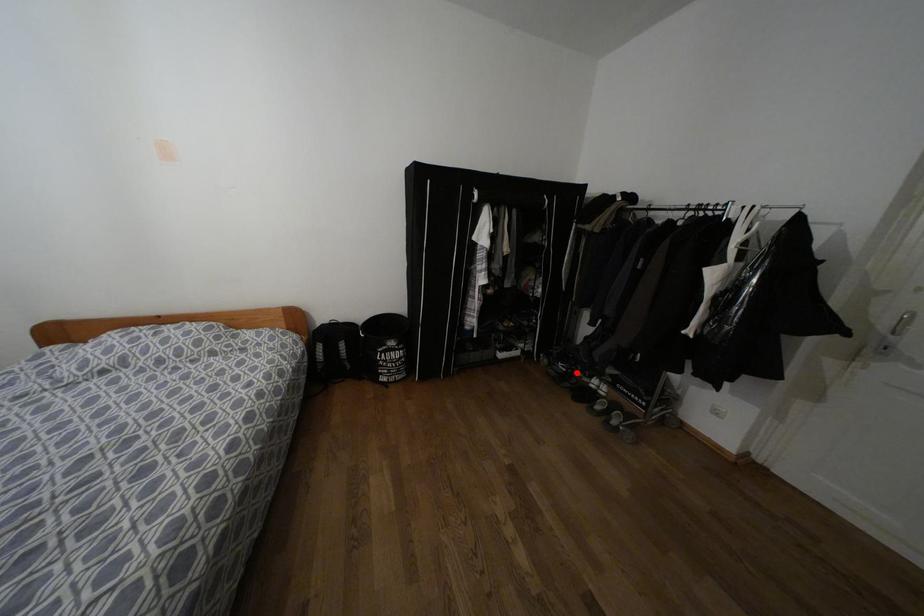
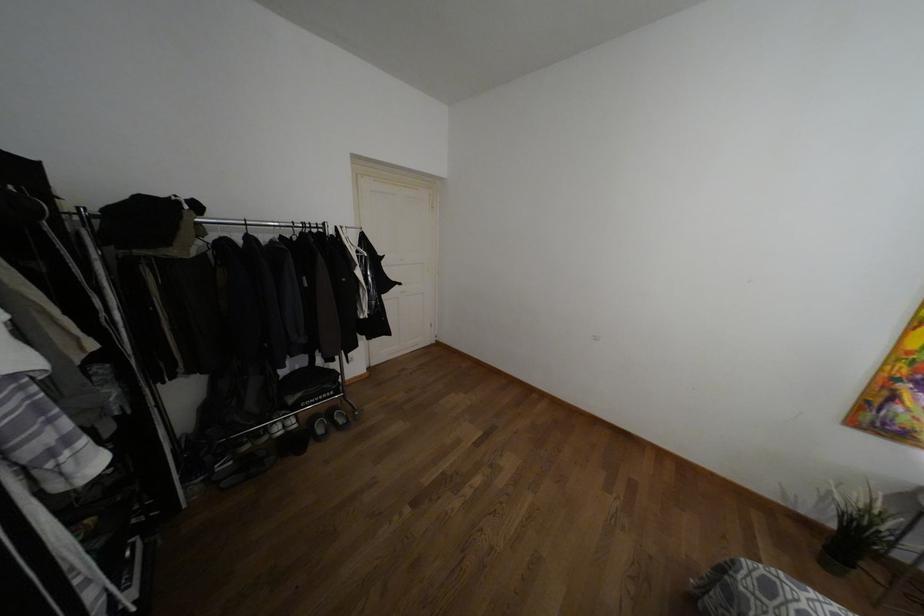
Locate, in the second image, the point that corresponds to the highlighted location in the first image.

(246, 447)